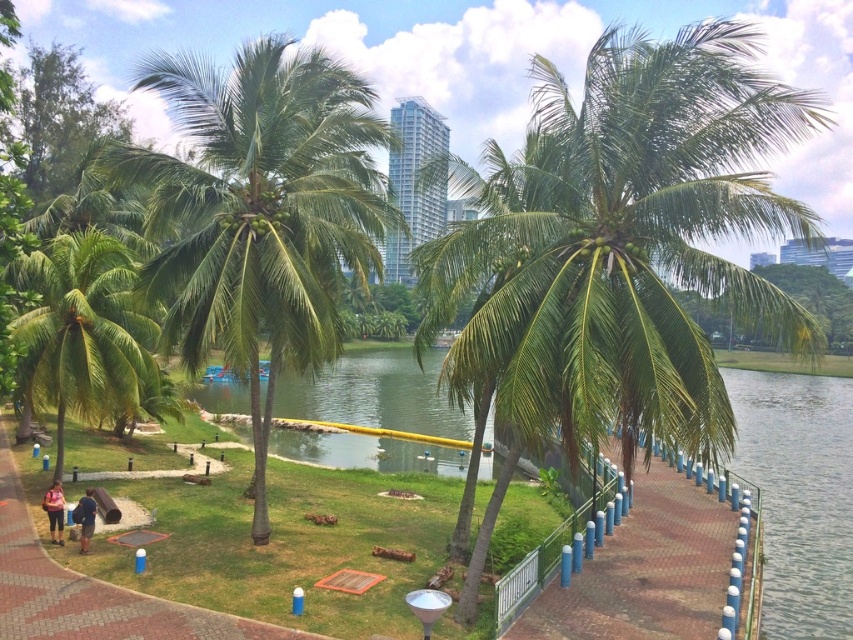
Between green leafy palm tree at lower left and brown brick path at lower left, which one is positioned higher?

green leafy palm tree at lower left is above.

This screenshot has width=853, height=640. I want to click on green leafy palm tree at lower left, so click(x=83, y=330).

Who is more forward, (33, 339) or (0, 460)?

Point (33, 339)

Image resolution: width=853 pixels, height=640 pixels. Identify the location of green leafy palm tree at lower left. (83, 330).

In the scene shown: Does green leafy palm tree at center have a smaller size compared to brown brick path at lower left?

Incorrect, green leafy palm tree at center is not smaller in size than brown brick path at lower left.

Measure the distance between point (312, 216) and camera.

Point (312, 216) is 16.42 meters away from camera.

The width and height of the screenshot is (853, 640). What do you see at coordinates (260, 211) in the screenshot?
I see `green leafy palm tree at center` at bounding box center [260, 211].

Find the location of `green leafy palm tree at center`. green leafy palm tree at center is located at coordinates (260, 211).

Is green leafy palm tree at lower left wider than matte pink shorts at lower left?

Yes, green leafy palm tree at lower left is wider than matte pink shorts at lower left.

Is green leafy palm tree at lower left positioned behind matte pink shorts at lower left?

Yes, green leafy palm tree at lower left is further from the viewer.

Is point (83, 360) positioned before point (48, 513)?

No, (83, 360) is further to viewer.

The width and height of the screenshot is (853, 640). Find the location of `green leafy palm tree at lower left`. green leafy palm tree at lower left is located at coordinates (83, 330).